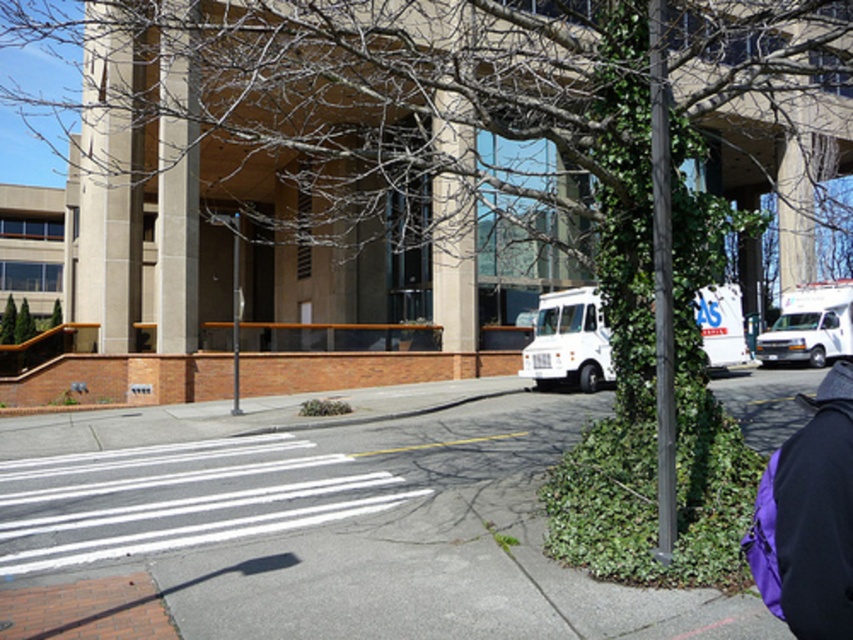
Question: Is gray asphalt at center closer to the viewer compared to purple fleece sweatshirt at lower right?

Choices:
 (A) yes
 (B) no

Answer: (B)

Question: Considering the real-world distances, which object is closest to the gray asphalt at center?

Choices:
 (A) concrete column at center
 (B) white matte van at right

Answer: (A)

Question: Can you confirm if concrete column at center is positioned above white matte van at right?

Choices:
 (A) no
 (B) yes

Answer: (B)

Question: Which point is closer to the camera?

Choices:
 (A) concrete column at center
 (B) white matte truck at center-right
 (C) white matte van at right

Answer: (A)

Question: Which object is positioned closest to the white matte truck at center-right?

Choices:
 (A) white matte van at right
 (B) concrete column at center
 (C) purple fleece sweatshirt at lower right
 (D) gray asphalt at center

Answer: (A)

Question: Can you confirm if purple fleece sweatshirt at lower right is smaller than white matte van at right?

Choices:
 (A) yes
 (B) no

Answer: (A)